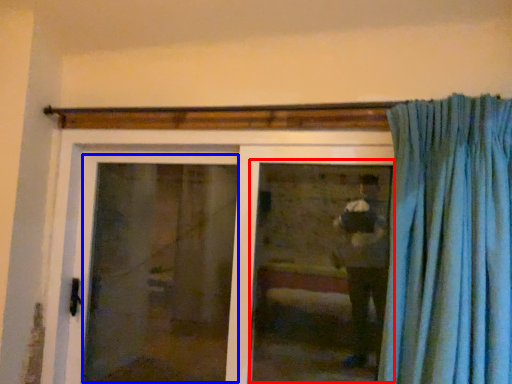
Question: Which point is further to the camera, window (highlighted by a red box) or screen door (highlighted by a blue box)?

Choices:
 (A) window
 (B) screen door

Answer: (B)